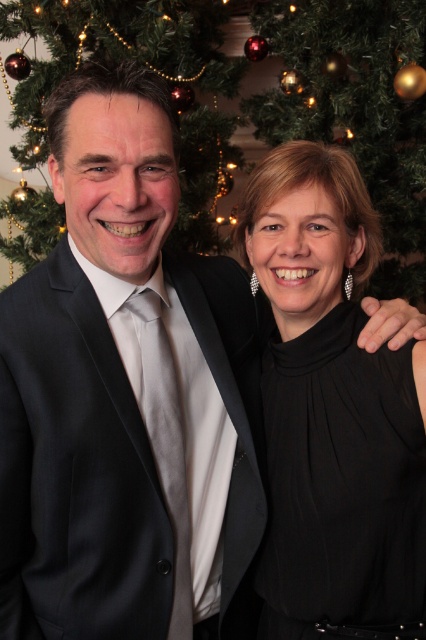
Does dark gray suit at center have a larger size compared to black satin dress at right?

Correct, dark gray suit at center is larger in size than black satin dress at right.

Who is higher up, dark gray suit at center or black satin dress at right?

dark gray suit at center

Is point (86, 636) in front of point (416, 563)?

Yes.

I want to click on dark gray suit at center, so (x=74, y=472).

Image resolution: width=426 pixels, height=640 pixels. In order to click on black satin dress at right in this screenshot , I will do `click(342, 486)`.

Who is higher up, black satin dress at right or green matte christmas tree at upper left?

Positioned higher is green matte christmas tree at upper left.

Locate an element on the screen. The width and height of the screenshot is (426, 640). black satin dress at right is located at coordinates (342, 486).

Can you confirm if dark gray suit at center is taller than green matte christmas tree at upper left?

Incorrect, dark gray suit at center's height is not larger of green matte christmas tree at upper left's.

Between dark gray suit at center and green matte christmas tree at upper left, which one has more height?

green matte christmas tree at upper left is taller.

Describe the element at coordinates (74, 472) in the screenshot. This screenshot has width=426, height=640. I see `dark gray suit at center` at that location.

Locate an element on the screen. The height and width of the screenshot is (640, 426). dark gray suit at center is located at coordinates (74, 472).